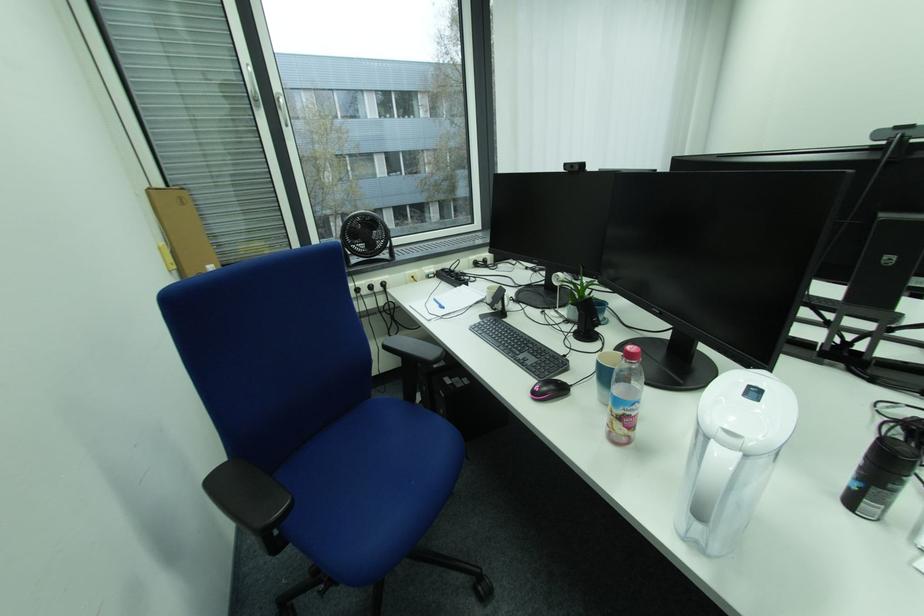
Identify the location of blue chair sitting surface. The height and width of the screenshot is (616, 924). (378, 466).